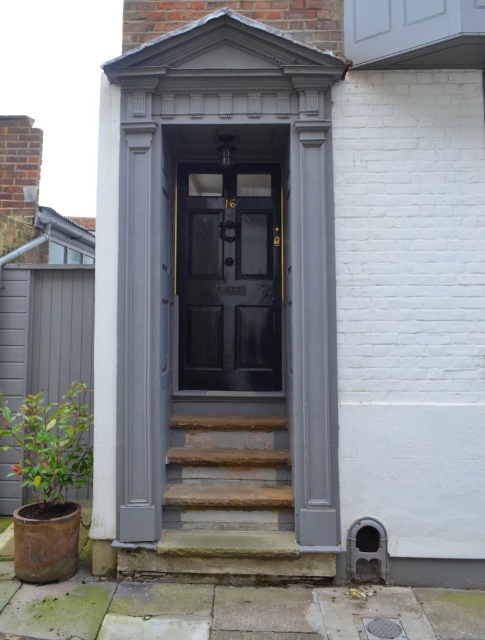
Can you confirm if natural stone stairs at center is bigger than green leafy plant at lower left?

Correct, natural stone stairs at center is larger in size than green leafy plant at lower left.

Which of these two, natural stone stairs at center or green leafy plant at lower left, stands taller?

Standing taller between the two is natural stone stairs at center.

Is point (182, 481) positioned behind point (16, 440)?

No, it is not.

Find the location of `natural stone stairs at center`. natural stone stairs at center is located at coordinates (227, 502).

Is matte black door at center bigger than green leafy plant at lower left?

Incorrect, matte black door at center is not larger than green leafy plant at lower left.

Does point (181, 230) lie behind point (23, 444)?

Yes, point (181, 230) is farther from viewer.

Where is `matte black door at center`? The width and height of the screenshot is (485, 640). matte black door at center is located at coordinates (228, 276).

Does matte black door at center have a greater width compared to natural stone stairs at center?

In fact, matte black door at center might be narrower than natural stone stairs at center.

Who is positioned more to the right, matte black door at center or natural stone stairs at center?

matte black door at center

Which is behind, point (231, 323) or point (251, 440)?

Positioned behind is point (231, 323).

Where is `matte black door at center`? The height and width of the screenshot is (640, 485). matte black door at center is located at coordinates (228, 276).